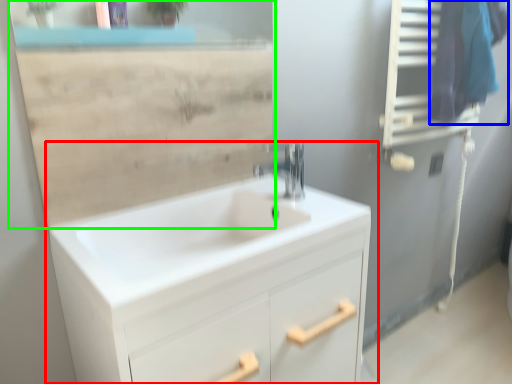
Question: Which object is the closest to the bathroom cabinet (highlighted by a red box)? Choose among these: laundry (highlighted by a blue box) or mirror (highlighted by a green box).

Choices:
 (A) laundry
 (B) mirror

Answer: (B)